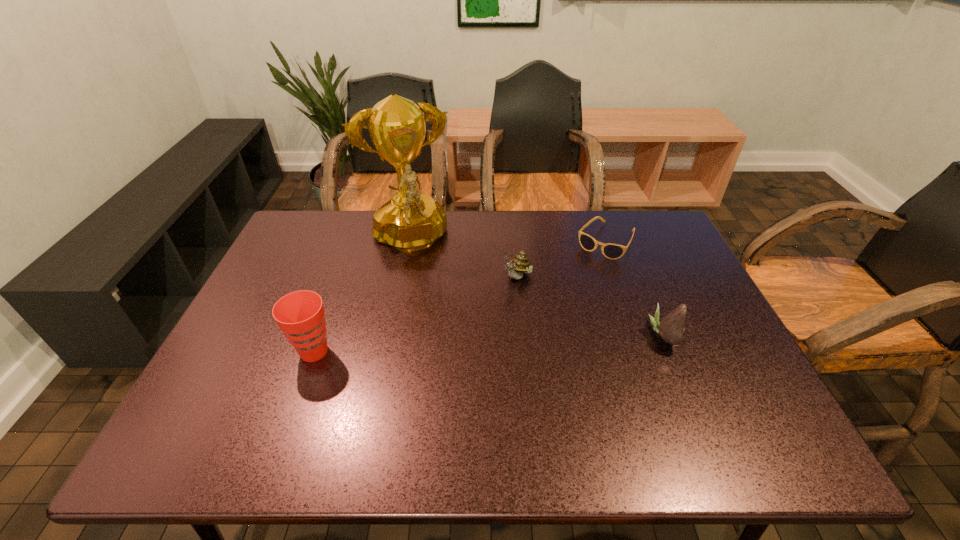
The image size is (960, 540). Identify the location of vacant region that satisfies the following two spatial constraints: 1. on the front side of the third object from right to left; 2. on the seed side of the avocado. click(523, 335).